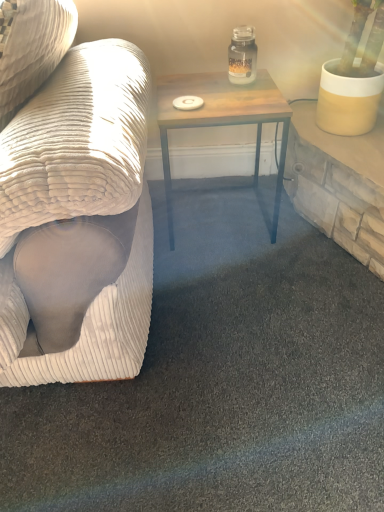
Question: Is white corduroy couch at left positioned far away from clear glass jar at upper center?

Choices:
 (A) yes
 (B) no

Answer: (B)

Question: From the image's perspective, does white corduroy couch at left appear lower than clear glass jar at upper center?

Choices:
 (A) no
 (B) yes

Answer: (B)

Question: Is white corduroy couch at left shorter than clear glass jar at upper center?

Choices:
 (A) no
 (B) yes

Answer: (A)

Question: Considering the relative positions of white corduroy couch at left and clear glass jar at upper center in the image provided, is white corduroy couch at left to the right of clear glass jar at upper center from the viewer's perspective?

Choices:
 (A) no
 (B) yes

Answer: (A)

Question: Is white corduroy couch at left positioned before clear glass jar at upper center?

Choices:
 (A) yes
 (B) no

Answer: (A)

Question: Can you confirm if white corduroy couch at left is bigger than clear glass jar at upper center?

Choices:
 (A) yes
 (B) no

Answer: (A)

Question: Is white corduroy couch at left not within wooden table at center?

Choices:
 (A) no
 (B) yes

Answer: (B)

Question: Is wooden table at center at the back of white corduroy couch at left?

Choices:
 (A) no
 (B) yes

Answer: (B)

Question: Can you confirm if white corduroy couch at left is smaller than wooden table at center?

Choices:
 (A) no
 (B) yes

Answer: (A)

Question: Could wooden table at center be considered to be inside white corduroy couch at left?

Choices:
 (A) yes
 (B) no

Answer: (B)

Question: Considering the relative sizes of white corduroy couch at left and wooden table at center in the image provided, is white corduroy couch at left shorter than wooden table at center?

Choices:
 (A) no
 (B) yes

Answer: (A)

Question: From a real-world perspective, is white corduroy couch at left located higher than wooden table at center?

Choices:
 (A) yes
 (B) no

Answer: (A)

Question: Can you confirm if clear glass jar at upper center is positioned to the left of white corduroy couch at left?

Choices:
 (A) yes
 (B) no

Answer: (B)